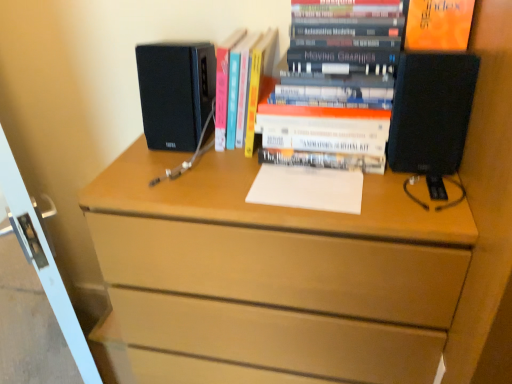
How much space does black matte speaker at right, which ranks as the first desktop computer in right-to-left order, occupy vertically?

black matte speaker at right, which ranks as the first desktop computer in right-to-left order, is 10.22 inches in height.

In order to click on orange matte paper at upper right in this screenshot , I will do `click(438, 25)`.

From the picture: Measure the distance between point (256, 191) and camera.

Point (256, 191) is 35.63 inches from camera.

Describe the element at coordinates (336, 81) in the screenshot. I see `hardcover books at center, which appears as the 2th book when viewed from the left` at that location.

Measure the distance between white glossy screen door at left and camera.

The distance of white glossy screen door at left from camera is 34.41 inches.

Describe the element at coordinates (175, 92) in the screenshot. I see `black matte speaker at upper left, the first desktop computer positioned from the left` at that location.

Locate an element on the screen. The image size is (512, 384). black matte speaker at upper left, which is the second desktop computer in right-to-left order is located at coordinates (175, 92).

You are a GUI agent. You are given a task and a screenshot of the screen. Output one action in this format:
    pyautogui.click(x=<x>, y=<y>)
    Task: Click on the black matte speaker at right, which ranks as the first desktop computer in right-to-left order
    
    Given the screenshot: What is the action you would take?
    pyautogui.click(x=431, y=112)

In the scene shown: Which is closer, (x=441, y=8) or (x=178, y=51)?

Answer: Point (x=441, y=8)

Which object is thinner, orange matte paper at upper right or black matte speaker at upper left, the first desktop computer positioned from the left?

orange matte paper at upper right is thinner.

Considering the sizes of orange matte paper at upper right and black matte speaker at upper left, the first desktop computer positioned from the left, in the image, is orange matte paper at upper right bigger or smaller than black matte speaker at upper left, the first desktop computer positioned from the left,?

In the image, orange matte paper at upper right appears to be smaller than black matte speaker at upper left, the first desktop computer positioned from the left.

Is orange matte paper at upper right closer to camera compared to black matte speaker at upper left, the first desktop computer positioned from the left?

That is True.

Based on their positions, is black matte speaker at upper left, which is the second desktop computer in right-to-left order, located to the left or right of white glossy screen door at left?

black matte speaker at upper left, which is the second desktop computer in right-to-left order, is positioned on white glossy screen door at left's right side.

How much distance is there between black matte speaker at upper left, the first desktop computer positioned from the left, and white glossy screen door at left?

15.94 inches.

Does black matte speaker at upper left, the first desktop computer positioned from the left, touch white glossy screen door at left?

No, black matte speaker at upper left, the first desktop computer positioned from the left, is not with white glossy screen door at left.

Starting from the white glossy screen door at left, which desktop computer is the 2nd one behind? Please provide its 2D coordinates.

[(175, 92)]

Considering the positions of objects hardcover books at center, which appears as the 2th book when viewed from the left, and orange matte paper at upper right in the image provided, who is more to the right, hardcover books at center, which appears as the 2th book when viewed from the left, or orange matte paper at upper right?

From the viewer's perspective, orange matte paper at upper right appears more on the right side.

From a real-world perspective, relative to orange matte paper at upper right, is hardcover books at center, which appears as the 2th book when viewed from the left, vertically above or below?

hardcover books at center, which appears as the 2th book when viewed from the left, is below orange matte paper at upper right.

In terms of width, does hardcover books at center, which appears as the 2th book when viewed from the left, look wider or thinner when compared to orange matte paper at upper right?

hardcover books at center, which appears as the 2th book when viewed from the left, is wider than orange matte paper at upper right.

From the image's perspective, who appears lower, hardcover books at center, marked as the first book in a right-to-left arrangement, or orange matte paper at upper right?

hardcover books at center, marked as the first book in a right-to-left arrangement, is shown below in the image.

Based on the photo, is black matte speaker at upper left, the first desktop computer positioned from the left, next to black matte speaker at right, the 2th desktop computer in the left-to-right sequence?

black matte speaker at upper left, the first desktop computer positioned from the left, and black matte speaker at right, the 2th desktop computer in the left-to-right sequence, are not in contact.

Does black matte speaker at upper left, which is the second desktop computer in right-to-left order, turn towards black matte speaker at right, the 2th desktop computer in the left-to-right sequence?

No, black matte speaker at upper left, which is the second desktop computer in right-to-left order, is not aimed at black matte speaker at right, the 2th desktop computer in the left-to-right sequence.

Which is in front, black matte speaker at upper left, the first desktop computer positioned from the left, or black matte speaker at right, the 2th desktop computer in the left-to-right sequence?

black matte speaker at right, the 2th desktop computer in the left-to-right sequence, is more forward.

From a real-world perspective, which object stands above the other?

From a 3D spatial view, black matte speaker at right, which ranks as the first desktop computer in right-to-left order, is above.

Which is nearer, (408, 14) or (391, 125)?

The point (408, 14) is more forward.

This screenshot has height=384, width=512. I want to click on paperback book behind the black matte speaker at right, the 2th desktop computer in the left-to-right sequence, so coord(438,25).

Based on the photo, which object is positioned more to the left, orange matte paper at upper right or black matte speaker at right, which ranks as the first desktop computer in right-to-left order?

From the viewer's perspective, black matte speaker at right, which ranks as the first desktop computer in right-to-left order, appears more on the left side.

From a real-world perspective, which is physically above, orange matte paper at upper right or black matte speaker at right, which ranks as the first desktop computer in right-to-left order?

In real-world perspective, orange matte paper at upper right is above.

Considering the relative sizes of white glossy screen door at left and black matte speaker at right, which ranks as the first desktop computer in right-to-left order, in the image provided, is white glossy screen door at left smaller than black matte speaker at right, which ranks as the first desktop computer in right-to-left order,?

Actually, white glossy screen door at left might be larger than black matte speaker at right, which ranks as the first desktop computer in right-to-left order.

From the image's perspective, would you say white glossy screen door at left is positioned over black matte speaker at right, the 2th desktop computer in the left-to-right sequence?

No, from the image's perspective, white glossy screen door at left is not over black matte speaker at right, the 2th desktop computer in the left-to-right sequence.

From a real-world perspective, is white glossy screen door at left physically located above or below black matte speaker at right, the 2th desktop computer in the left-to-right sequence?

In terms of real-world spatial position, white glossy screen door at left is below black matte speaker at right, the 2th desktop computer in the left-to-right sequence.

Does white glossy screen door at left appear on the right side of black matte speaker at right, the 2th desktop computer in the left-to-right sequence?

No, white glossy screen door at left is not to the right of black matte speaker at right, the 2th desktop computer in the left-to-right sequence.

From the image's perspective, is hardcover book at center, which appears as the first book when viewed from the left, on top of black matte speaker at upper left, the first desktop computer positioned from the left?

No.

From a real-world perspective, is hardcover book at center, which appears as the first book when viewed from the left, physically located above or below black matte speaker at upper left, the first desktop computer positioned from the left?

hardcover book at center, which appears as the first book when viewed from the left, is situated lower than black matte speaker at upper left, the first desktop computer positioned from the left, in the real world.

How distant is hardcover book at center, the 2th book positioned from the right, from black matte speaker at upper left, which is the second desktop computer in right-to-left order?

hardcover book at center, the 2th book positioned from the right, and black matte speaker at upper left, which is the second desktop computer in right-to-left order, are 5.58 inches apart from each other.

From a real-world perspective, which desktop computer is the 1st one above the hardcover book at center, which appears as the first book when viewed from the left? Please provide its 2D coordinates.

[(175, 92)]

From the image's perspective, which desktop computer is the 1st one below the orange matte paper at upper right? Please provide its 2D coordinates.

[(175, 92)]

This screenshot has width=512, height=384. What are the coordinates of `the 2nd desktop computer above the white glossy screen door at left (from the image's perspective)` in the screenshot? It's located at (175, 92).

Which object lies further to the anchor point hardcover book at center, which appears as the first book when viewed from the left, black matte speaker at right, which ranks as the first desktop computer in right-to-left order, or white paper at center?

black matte speaker at right, which ranks as the first desktop computer in right-to-left order, is positioned further to the anchor hardcover book at center, which appears as the first book when viewed from the left.

Based on their spatial positions, is black matte speaker at upper left, the first desktop computer positioned from the left, or orange matte paper at upper right closer to white glossy screen door at left?

black matte speaker at upper left, the first desktop computer positioned from the left.

Considering their positions, is black matte speaker at right, which ranks as the first desktop computer in right-to-left order, positioned closer to orange matte paper at upper right than white paper at center?

→ The object closer to orange matte paper at upper right is black matte speaker at right, which ranks as the first desktop computer in right-to-left order.

When comparing their distances from white glossy screen door at left, does hardcover book at center, which appears as the first book when viewed from the left, or orange matte paper at upper right seem further?

orange matte paper at upper right.

Estimate the real-world distances between objects in this image. Which object is further from hardcover books at center, which appears as the 2th book when viewed from the left, white glossy screen door at left or black matte speaker at right, the 2th desktop computer in the left-to-right sequence?

white glossy screen door at left.

Considering their positions, is white paper at center positioned closer to black matte speaker at right, the 2th desktop computer in the left-to-right sequence, than hardcover book at center, which appears as the first book when viewed from the left?

Among the two, white paper at center is located nearer to black matte speaker at right, the 2th desktop computer in the left-to-right sequence.

Which object lies further to the anchor point black matte speaker at upper left, which is the second desktop computer in right-to-left order, hardcover book at center, which appears as the first book when viewed from the left, or orange matte paper at upper right?

orange matte paper at upper right is further to black matte speaker at upper left, which is the second desktop computer in right-to-left order.

Estimate the real-world distances between objects in this image. Which object is further from white glossy screen door at left, hardcover book at center, the 2th book positioned from the right, or black matte speaker at upper left, the first desktop computer positioned from the left?

The object further to white glossy screen door at left is hardcover book at center, the 2th book positioned from the right.

You are a GUI agent. You are given a task and a screenshot of the screen. Output one action in this format:
    pyautogui.click(x=<x>, y=<y>)
    Task: Click on the book situated between white glossy screen door at left and hardcover books at center, which appears as the 2th book when viewed from the left, from left to right
    
    Given the screenshot: What is the action you would take?
    pyautogui.click(x=253, y=88)

Locate an element on the screen. The height and width of the screenshot is (384, 512). book situated between hardcover book at center, the 2th book positioned from the right, and orange matte paper at upper right from left to right is located at coordinates (336, 81).

Locate an element on the screen. Image resolution: width=512 pixels, height=384 pixels. notepad situated between white glossy screen door at left and black matte speaker at right, which ranks as the first desktop computer in right-to-left order, from left to right is located at coordinates (308, 188).

Locate an element on the screen. notepad between black matte speaker at upper left, which is the second desktop computer in right-to-left order, and black matte speaker at right, which ranks as the first desktop computer in right-to-left order is located at coordinates (308, 188).